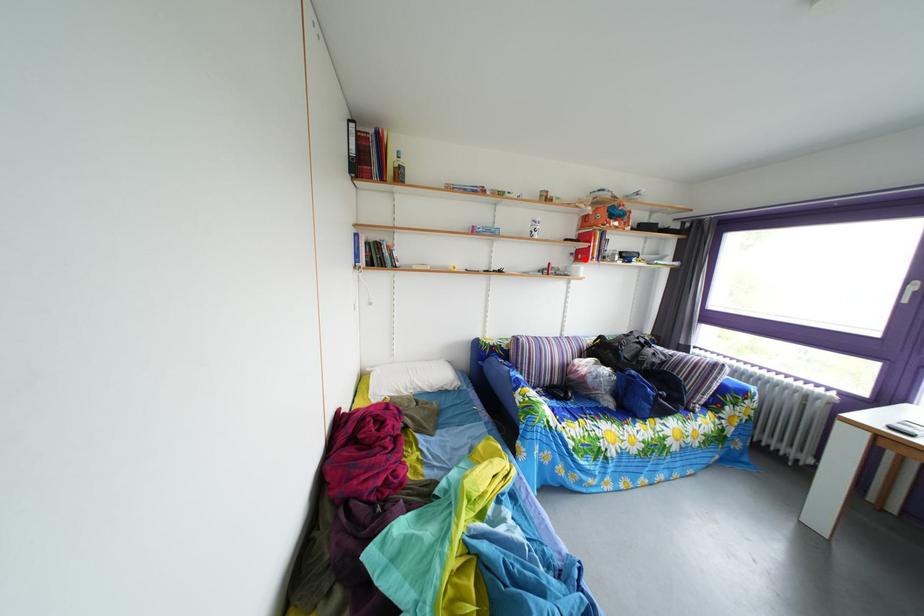
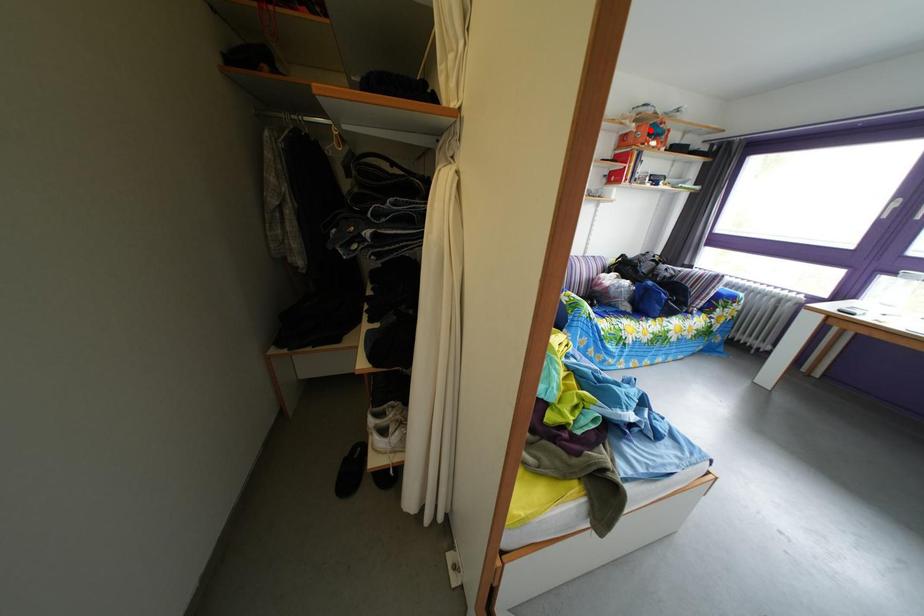
I am providing you with two images of the same scene from different viewpoints. A red point is marked on the first image and another point is marked on the second image. Are the points marked in image1 and image2 representing the same 3D position?

No